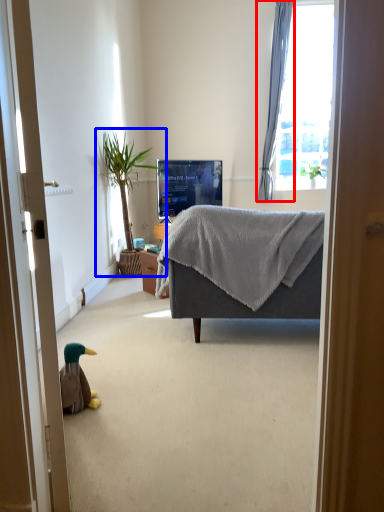
Question: Which of the following is the farthest to the observer, curtain (highlighted by a red box) or houseplant (highlighted by a blue box)?

Choices:
 (A) curtain
 (B) houseplant

Answer: (A)